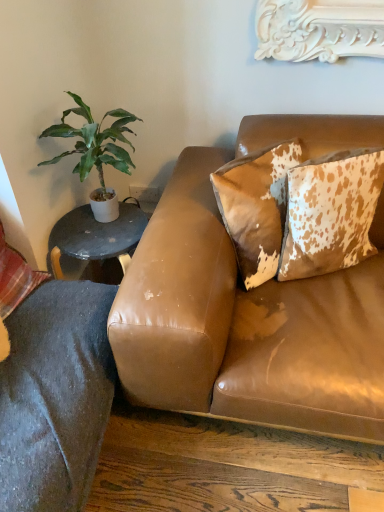
The width and height of the screenshot is (384, 512). Describe the element at coordinates (15, 277) in the screenshot. I see `plaid fabric pillow at lower left, which is the 3th pillow from right to left` at that location.

This screenshot has height=512, width=384. In order to click on cowhide pillow at upper right, the 1th pillow when ordered from right to left in this screenshot , I will do `click(330, 212)`.

In order to face brown leather couch at upper right, should I rotate leftwards or rightwards?

Turn right by 13.602 degrees to look at brown leather couch at upper right.

What are the coordinates of `plaid fabric pillow at lower left, which is counted as the first pillow, starting from the left` in the screenshot? It's located at (15, 277).

Is brown textured pillow at upper right, which appears as the 2th pillow when viewed from the left, in contact with green leafy plant at left?

No, brown textured pillow at upper right, which appears as the 2th pillow when viewed from the left, is not with green leafy plant at left.

From a real-world perspective, who is located higher, brown textured pillow at upper right, which appears as the 2th pillow when viewed from the left, or green leafy plant at left?

In real-world perspective, green leafy plant at left is above.

Is the depth of brown textured pillow at upper right, which appears as the 2th pillow when viewed from the left, less than that of green leafy plant at left?

That is True.

Does brown textured pillow at upper right, which is counted as the second pillow, starting from the right, have a larger size compared to green leafy plant at left?

Actually, brown textured pillow at upper right, which is counted as the second pillow, starting from the right, might be smaller than green leafy plant at left.

Between brown leather couch at upper right and brown textured pillow at upper right, which appears as the 2th pillow when viewed from the left, which one has smaller size?

brown textured pillow at upper right, which appears as the 2th pillow when viewed from the left, is smaller.

Does brown leather couch at upper right come behind brown textured pillow at upper right, which appears as the 2th pillow when viewed from the left?

No, brown leather couch at upper right is closer to the viewer.

Based on the photo, from their relative heights in the image, would you say brown leather couch at upper right is taller or shorter than brown textured pillow at upper right, which is counted as the second pillow, starting from the right?

Clearly, brown leather couch at upper right is taller compared to brown textured pillow at upper right, which is counted as the second pillow, starting from the right.

Locate an element on the screen. This screenshot has width=384, height=512. the 1st pillow to the left of the brown leather couch at upper right, counting from the anchor's position is located at coordinates (256, 207).

Considering the sizes of objects cowhide pillow at upper right, the 1th pillow when ordered from right to left, and brown leather couch at upper right in the image provided, who is bigger, cowhide pillow at upper right, the 1th pillow when ordered from right to left, or brown leather couch at upper right?

With larger size is brown leather couch at upper right.

Is brown leather couch at upper right at the back of cowhide pillow at upper right, the 1th pillow when ordered from right to left?

Yes, cowhide pillow at upper right, the 1th pillow when ordered from right to left, is facing away from brown leather couch at upper right.

Does cowhide pillow at upper right, the 1th pillow when ordered from right to left, have a lesser width compared to brown leather couch at upper right?

Yes.

From a real-world perspective, is cowhide pillow at upper right, the 1th pillow when ordered from right to left, over brown leather couch at upper right?

Yes, from a real-world perspective, cowhide pillow at upper right, the 1th pillow when ordered from right to left, is over brown leather couch at upper right

Is brown leather couch at upper right positioned with its back to green leafy plant at left?

No, brown leather couch at upper right is not facing away from green leafy plant at left.

Looking at this image, is brown leather couch at upper right wider or thinner than green leafy plant at left?

brown leather couch at upper right is wider than green leafy plant at left.

Considering the sizes of objects brown leather couch at upper right and green leafy plant at left in the image provided, who is smaller, brown leather couch at upper right or green leafy plant at left?

With smaller size is green leafy plant at left.

Find the location of a particular element. studio couch on the right of the green leafy plant at left is located at coordinates (246, 324).

Who is smaller, brown leather couch at upper right or cowhide pillow at upper right, the 1th pillow when ordered from right to left?

With smaller size is cowhide pillow at upper right, the 1th pillow when ordered from right to left.

Is brown leather couch at upper right facing away from cowhide pillow at upper right, marked as the 3th pillow in a left-to-right arrangement?

That's right, brown leather couch at upper right is facing away from cowhide pillow at upper right, marked as the 3th pillow in a left-to-right arrangement.

From a real-world perspective, which is physically below, brown leather couch at upper right or cowhide pillow at upper right, the 1th pillow when ordered from right to left?

brown leather couch at upper right.

Which object is closer to the camera taking this photo, brown leather couch at upper right or cowhide pillow at upper right, marked as the 3th pillow in a left-to-right arrangement?

Positioned in front is brown leather couch at upper right.

From the image's perspective, is brown textured pillow at upper right, which appears as the 2th pillow when viewed from the left, located above or below plaid fabric pillow at lower left, which is counted as the first pillow, starting from the left?

Based on their image positions, brown textured pillow at upper right, which appears as the 2th pillow when viewed from the left, is located above plaid fabric pillow at lower left, which is counted as the first pillow, starting from the left.

From a real-world perspective, is brown textured pillow at upper right, which is counted as the second pillow, starting from the right, under plaid fabric pillow at lower left, which is counted as the first pillow, starting from the left?

No.

In terms of height, does brown textured pillow at upper right, which is counted as the second pillow, starting from the right, look taller or shorter compared to plaid fabric pillow at lower left, which is counted as the first pillow, starting from the left?

Considering their sizes, brown textured pillow at upper right, which is counted as the second pillow, starting from the right, has less height than plaid fabric pillow at lower left, which is counted as the first pillow, starting from the left.

Considering the positions of objects brown textured pillow at upper right, which appears as the 2th pillow when viewed from the left, and plaid fabric pillow at lower left, which is the 3th pillow from right to left, in the image provided, who is behind, brown textured pillow at upper right, which appears as the 2th pillow when viewed from the left, or plaid fabric pillow at lower left, which is the 3th pillow from right to left,?

brown textured pillow at upper right, which appears as the 2th pillow when viewed from the left, is behind.

Does point (115, 157) come closer to viewer compared to point (19, 282)?

No, it is behind (19, 282).

From the image's perspective, is green leafy plant at left below plaid fabric pillow at lower left, which is the 3th pillow from right to left?

No.

Does green leafy plant at left have a lesser height compared to plaid fabric pillow at lower left, which is counted as the first pillow, starting from the left?

In fact, green leafy plant at left may be taller than plaid fabric pillow at lower left, which is counted as the first pillow, starting from the left.

How many degrees apart are the facing directions of green leafy plant at left and plaid fabric pillow at lower left, which is counted as the first pillow, starting from the left?

The angle between the facing direction of green leafy plant at left and the facing direction of plaid fabric pillow at lower left, which is counted as the first pillow, starting from the left, is 66 degrees.

You are a GUI agent. You are given a task and a screenshot of the screen. Output one action in this format:
    pyautogui.click(x=<x>, y=<y>)
    Task: Click on the houseplant above the brown textured pillow at upper right, which is counted as the second pillow, starting from the right (from a real-world perspective)
    This screenshot has height=512, width=384.
    Given the screenshot: What is the action you would take?
    pyautogui.click(x=96, y=151)

The width and height of the screenshot is (384, 512). Find the location of `the 1st pillow counting from the left side of the brown leather couch at upper right`. the 1st pillow counting from the left side of the brown leather couch at upper right is located at coordinates (256, 207).

Which object lies nearer to the anchor point brown textured pillow at upper right, which appears as the 2th pillow when viewed from the left, green leafy plant at left or plaid fabric pillow at lower left, which is counted as the first pillow, starting from the left?

The object closer to brown textured pillow at upper right, which appears as the 2th pillow when viewed from the left, is green leafy plant at left.

Which object lies further to the anchor point brown leather couch at upper right, green leafy plant at left or cowhide pillow at upper right, marked as the 3th pillow in a left-to-right arrangement?

green leafy plant at left is positioned further to the anchor brown leather couch at upper right.

Estimate the real-world distances between objects in this image. Which object is further from plaid fabric pillow at lower left, which is counted as the first pillow, starting from the left, green leafy plant at left or brown textured pillow at upper right, which is counted as the second pillow, starting from the right?

Among the two, brown textured pillow at upper right, which is counted as the second pillow, starting from the right, is located further to plaid fabric pillow at lower left, which is counted as the first pillow, starting from the left.

When comparing their distances from brown textured pillow at upper right, which appears as the 2th pillow when viewed from the left, does cowhide pillow at upper right, marked as the 3th pillow in a left-to-right arrangement, or brown leather couch at upper right seem closer?

The object closer to brown textured pillow at upper right, which appears as the 2th pillow when viewed from the left, is cowhide pillow at upper right, marked as the 3th pillow in a left-to-right arrangement.

Which object lies further to the anchor point brown textured pillow at upper right, which appears as the 2th pillow when viewed from the left, green leafy plant at left or cowhide pillow at upper right, the 1th pillow when ordered from right to left?

green leafy plant at left lies further to brown textured pillow at upper right, which appears as the 2th pillow when viewed from the left, than the other object.

Looking at the image, which one is located further to cowhide pillow at upper right, marked as the 3th pillow in a left-to-right arrangement, brown textured pillow at upper right, which is counted as the second pillow, starting from the right, or green leafy plant at left?

green leafy plant at left is positioned further to the anchor cowhide pillow at upper right, marked as the 3th pillow in a left-to-right arrangement.

Which object lies further to the anchor point green leafy plant at left, brown textured pillow at upper right, which is counted as the second pillow, starting from the right, or brown leather couch at upper right?

Based on the image, brown leather couch at upper right appears to be further to green leafy plant at left.

Estimate the real-world distances between objects in this image. Which object is further from brown leather couch at upper right, plaid fabric pillow at lower left, which is the 3th pillow from right to left, or green leafy plant at left?

plaid fabric pillow at lower left, which is the 3th pillow from right to left.

You are a GUI agent. You are given a task and a screenshot of the screen. Output one action in this format:
    pyautogui.click(x=<x>, y=<y>)
    Task: Click on the pillow located between plaid fabric pillow at lower left, which is counted as the first pillow, starting from the left, and brown leather couch at upper right in the left-right direction
    
    Given the screenshot: What is the action you would take?
    pyautogui.click(x=256, y=207)

Identify the location of houseplant between plaid fabric pillow at lower left, which is the 3th pillow from right to left, and brown leather couch at upper right. Image resolution: width=384 pixels, height=512 pixels. (96, 151).

Find the location of a particular element. The height and width of the screenshot is (512, 384). houseplant between plaid fabric pillow at lower left, which is the 3th pillow from right to left, and cowhide pillow at upper right, marked as the 3th pillow in a left-to-right arrangement, from left to right is located at coordinates (96, 151).

Find the location of a particular element. studio couch between plaid fabric pillow at lower left, which is the 3th pillow from right to left, and cowhide pillow at upper right, the 1th pillow when ordered from right to left, in the horizontal direction is located at coordinates (246, 324).